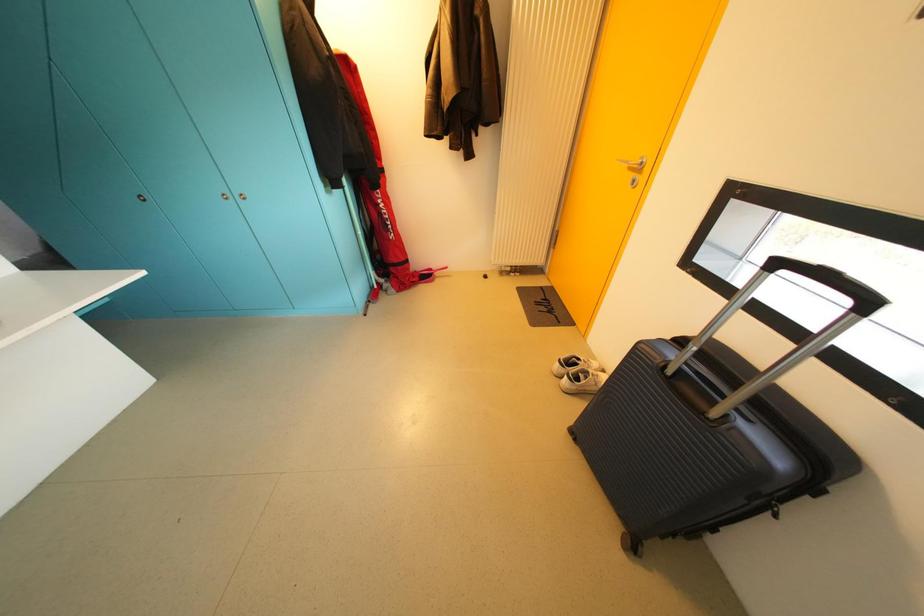
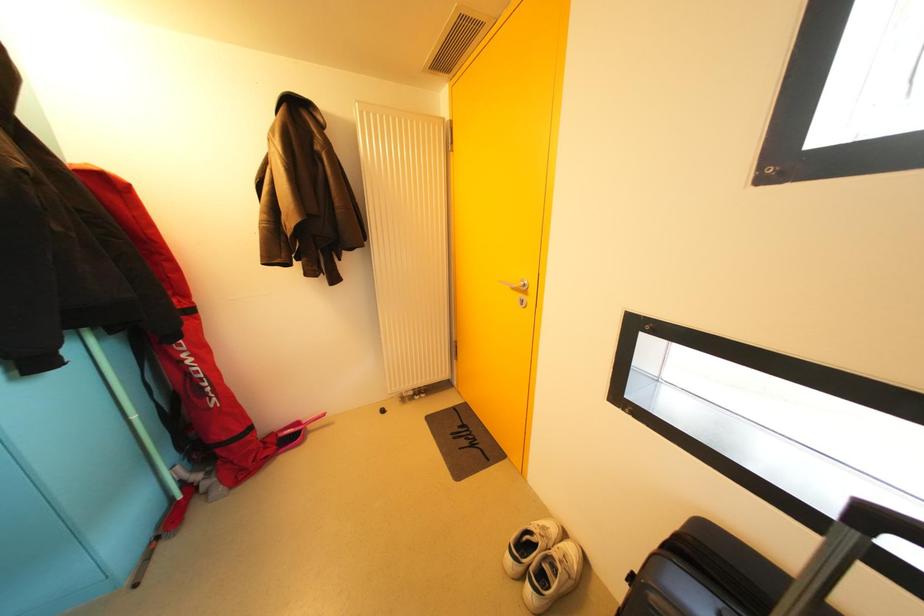
First-person continuous shooting, in which direction is the camera rotating?

The camera rotated toward right-up.